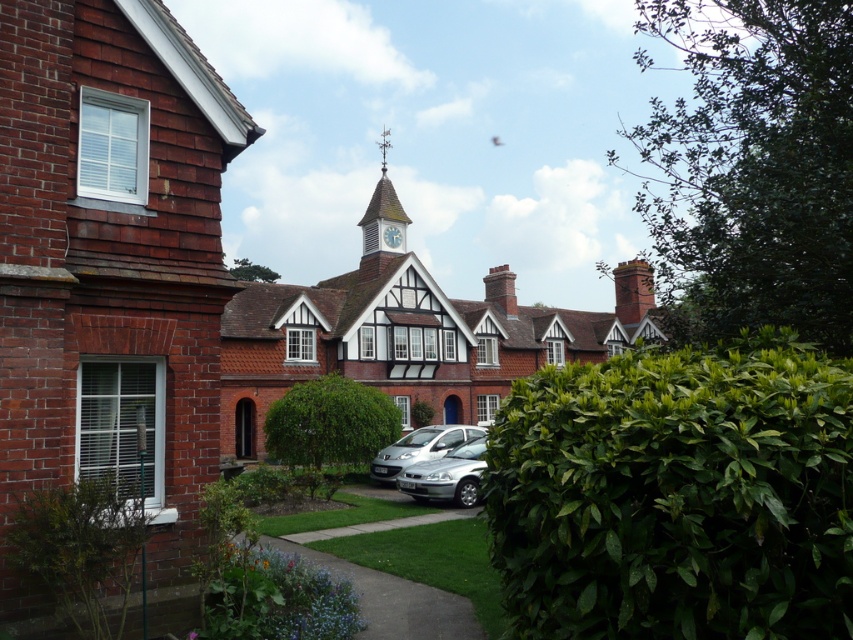
Is brick house at left wider than green leafy hedge at center?

Yes.

Is the position of brick house at left less distant than that of green leafy hedge at center?

Yes, it is in front of green leafy hedge at center.

Where is `brick house at left`? Image resolution: width=853 pixels, height=640 pixels. brick house at left is located at coordinates (109, 268).

Who is lower down, green leafy hedge at lower left or silver metallic car at center?

silver metallic car at center

Between point (131, 524) and point (450, 493), which one is positioned in front?

Positioned in front is point (131, 524).

Between point (117, 561) and point (410, 492), which one is positioned behind?

Point (410, 492)

Identify the location of green leafy hedge at lower left. (80, 548).

Is green leafy hedge at lower left to the left of green leafy hedge at center from the viewer's perspective?

In fact, green leafy hedge at lower left is to the right of green leafy hedge at center.

The image size is (853, 640). Describe the element at coordinates (80, 548) in the screenshot. I see `green leafy hedge at lower left` at that location.

Image resolution: width=853 pixels, height=640 pixels. Identify the location of green leafy hedge at lower left. (80, 548).

Where is `green leafy hedge at lower left`? The width and height of the screenshot is (853, 640). green leafy hedge at lower left is located at coordinates (80, 548).